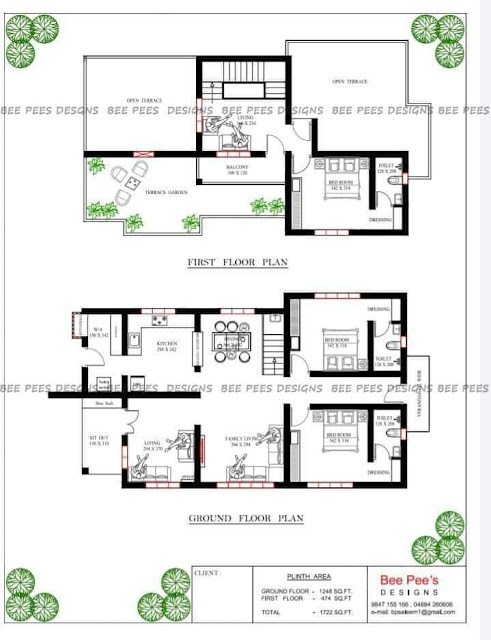
Identify the location of table. (130, 185), (231, 340).